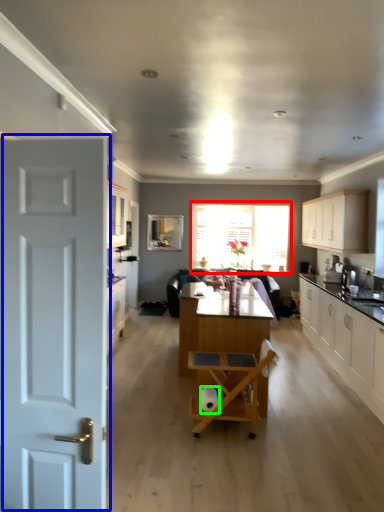
Question: Which object is positioned closest to window (highlighted by a red box)? Select from door (highlighted by a blue box) and toilet paper (highlighted by a green box).

Choices:
 (A) door
 (B) toilet paper

Answer: (B)